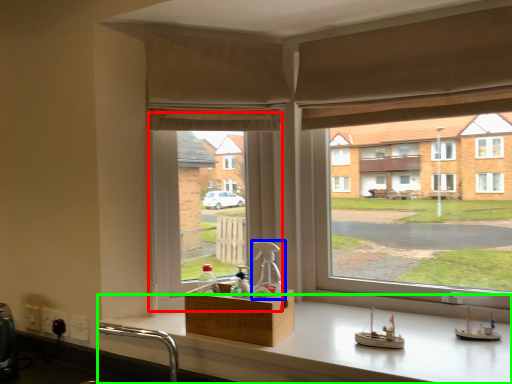
Question: Which is nearer to the window screen (highlighted by a red box)? bottle (highlighted by a blue box) or counter (highlighted by a green box).

Choices:
 (A) bottle
 (B) counter

Answer: (A)